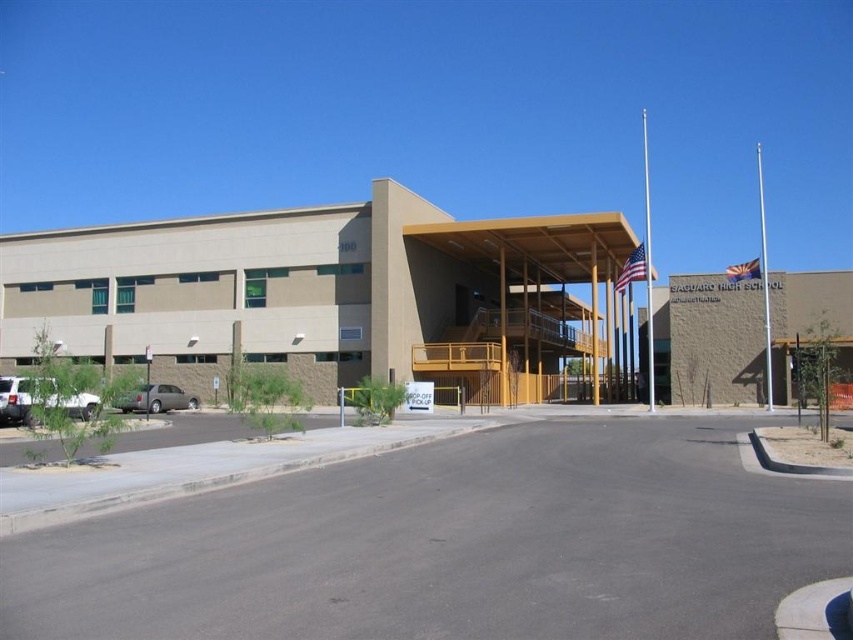
You are a delivery person driving a 5.5 meter long truck. You need to park your truck in the parking lot near the school building. There is a white matte truck at lower left and a gray metallic sedan at lower left. Can you park your truck between them without overlapping any vehicles?

The white matte truck at lower left and gray metallic sedan at lower left are 6.24 meters apart. Since your truck is 5.5 meters long, there is enough space between them to park without overlapping any vehicles.

You are standing at point (15, 401) in the school building scene. What object is located at this point?

The white matte truck at lower left is located at point (15, 401).